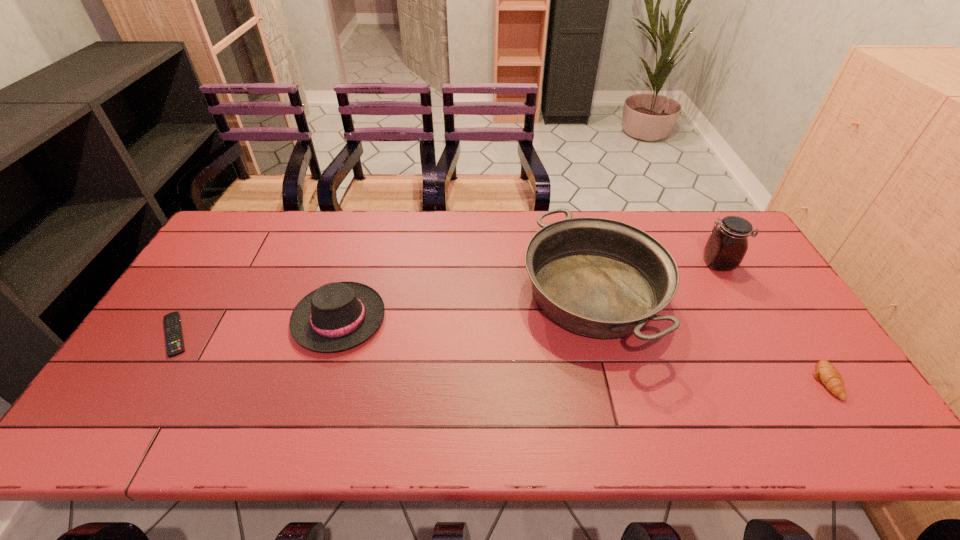
This screenshot has width=960, height=540. Identify the location of crescent roll that is at the right edge. (826, 373).

This screenshot has width=960, height=540. I want to click on object that is positioned at the far right corner, so click(x=727, y=245).

Find the location of a particular element. This screenshot has width=960, height=540. vacant space at the far edge of the desktop is located at coordinates (677, 220).

In the image, there is a desktop. Where is `vacant space at the near edge`? This screenshot has width=960, height=540. vacant space at the near edge is located at coordinates (376, 444).

Locate an element on the screen. This screenshot has width=960, height=540. vacant area at the right edge is located at coordinates (756, 292).

This screenshot has width=960, height=540. I want to click on vacant space at the far left corner of the desktop, so click(269, 213).

The width and height of the screenshot is (960, 540). In the image, there is a desktop. Identify the location of vacant space at the near left corner. (143, 436).

The image size is (960, 540). Identify the location of blank space at the far right corner of the desktop. (697, 235).

Identify the location of vacant region between the shortest object and the fourth object from right to left. Image resolution: width=960 pixels, height=540 pixels. (257, 327).

Where is `empty space that is in between the third shortest object and the jar`? The width and height of the screenshot is (960, 540). empty space that is in between the third shortest object and the jar is located at coordinates (529, 291).